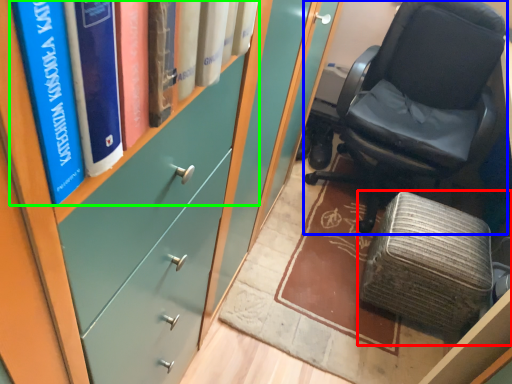
Question: Considering the real-world distances, which object is farthest from furniture (highlighted by a red box)? chair (highlighted by a blue box) or book (highlighted by a green box)?

Choices:
 (A) chair
 (B) book

Answer: (B)